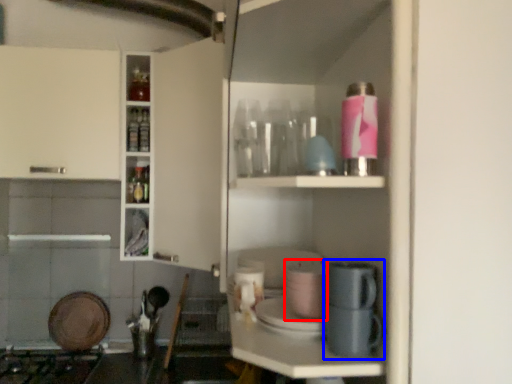
Question: Among these objects, which one is farthest to the camera, appliance (highlighted by a red box) or coffee machine (highlighted by a blue box)?

Choices:
 (A) appliance
 (B) coffee machine

Answer: (A)